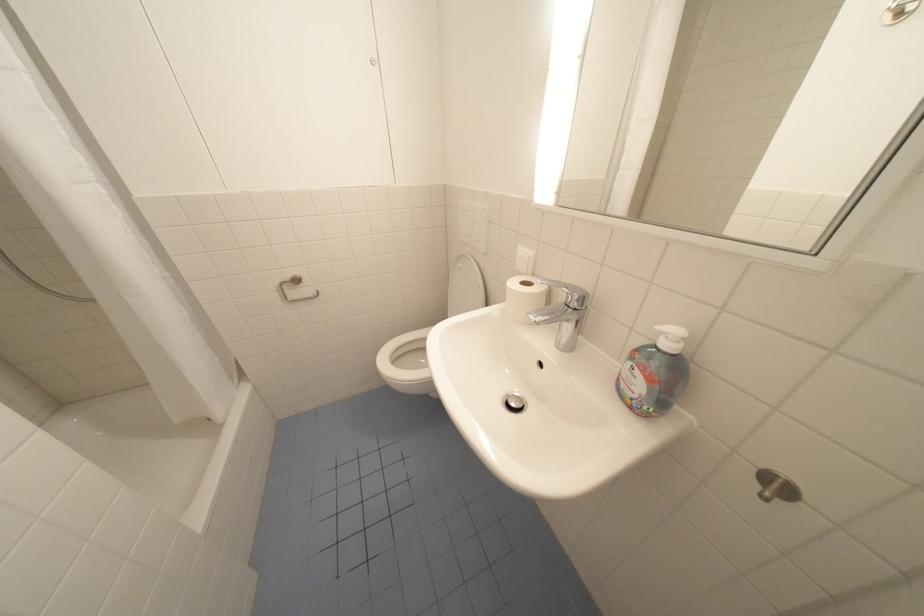
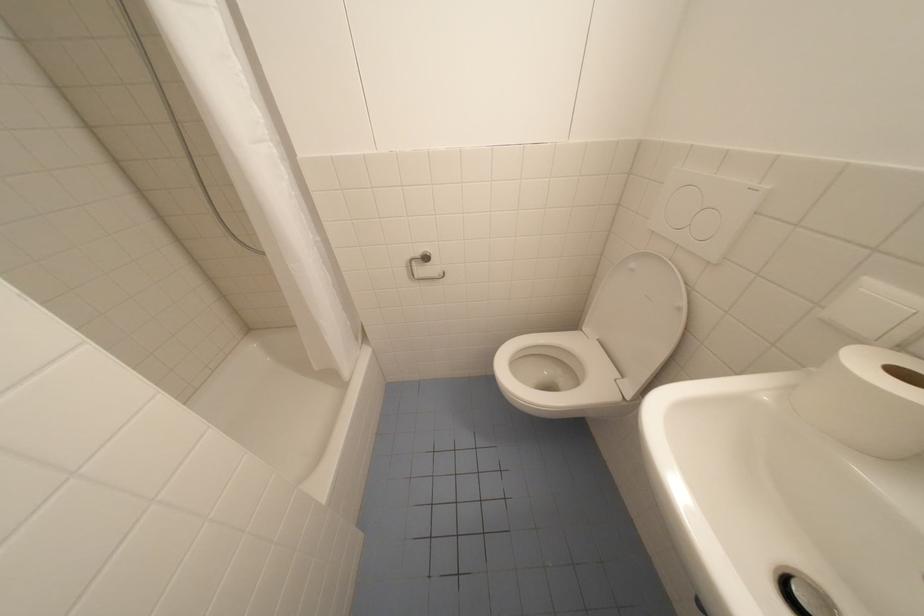
The images are taken continuously from a first-person perspective. In which direction are you moving?

The cameraman moved toward left, forward.